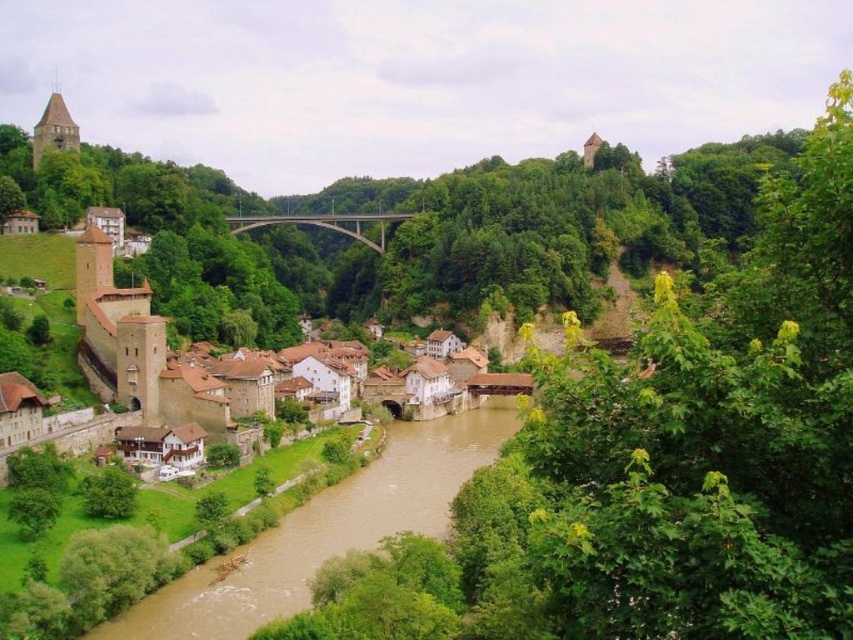
Can you confirm if brown muddy water at lower center is positioned below concrete bridge at center?

Yes, brown muddy water at lower center is below concrete bridge at center.

Does brown muddy water at lower center appear on the right side of concrete bridge at center?

Indeed, brown muddy water at lower center is positioned on the right side of concrete bridge at center.

This screenshot has width=853, height=640. What do you see at coordinates (325, 531) in the screenshot?
I see `brown muddy water at lower center` at bounding box center [325, 531].

Where is `brown muddy water at lower center`? brown muddy water at lower center is located at coordinates (325, 531).